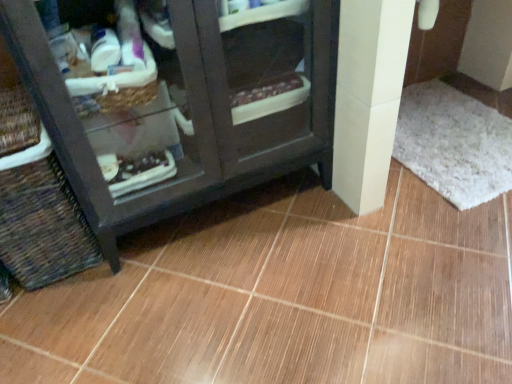
At what (x,y) coordinates should I click in order to perform the action: click on vacant space in front of white shaggy bath mat at lower right. Please return your answer as a coordinate pair (x, y). The height and width of the screenshot is (384, 512). Looking at the image, I should click on (430, 247).